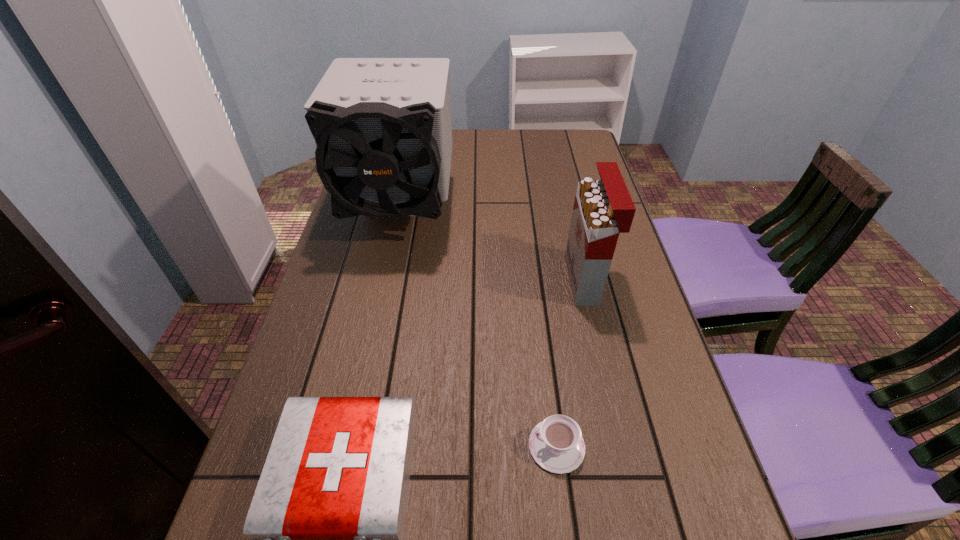
Locate an element on the screen. free space between the fan and the second tallest object is located at coordinates (492, 245).

Locate an element on the screen. The height and width of the screenshot is (540, 960). vacant space that is in between the teacup and the farthest object is located at coordinates (478, 328).

Locate an element on the screen. free area in between the rightmost object and the fan is located at coordinates (492, 245).

Identify which object is the third nearest to the tallest object. Please provide its 2D coordinates. Your answer should be formatted as a tuple, i.e. [(x, y)], where the tuple contains the x and y coordinates of a point satisfying the conditions above.

[(556, 444)]

This screenshot has height=540, width=960. Find the location of `object that is the third closest to the second shortest object`. object that is the third closest to the second shortest object is located at coordinates (382, 126).